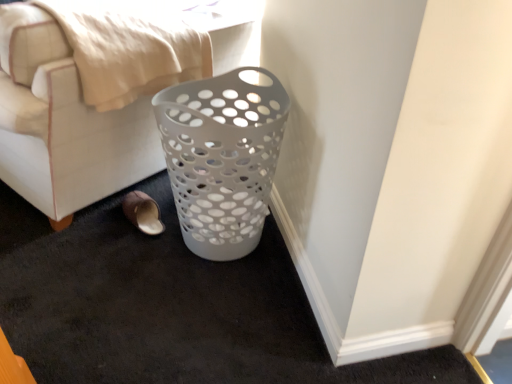
This screenshot has height=384, width=512. In order to click on brown suede slipper at lower left in this screenshot , I will do `click(143, 213)`.

Where is `white plastic laundry basket at lower center`? The height and width of the screenshot is (384, 512). white plastic laundry basket at lower center is located at coordinates (63, 123).

Locate an element on the screen. The width and height of the screenshot is (512, 384). white plastic basket at lower right is located at coordinates (222, 157).

Considering the points (148, 218) and (250, 231), which point is in front, point (148, 218) or point (250, 231)?

The point (250, 231) is closer to the camera.

Is brown suede slipper at lower left bigger than white plastic basket at lower right?

No, brown suede slipper at lower left is not bigger than white plastic basket at lower right.

Which object is thinner, brown suede slipper at lower left or white plastic basket at lower right?

brown suede slipper at lower left is thinner.

Considering the relative positions of brown suede slipper at lower left and white plastic basket at lower right in the image provided, is brown suede slipper at lower left to the left of white plastic basket at lower right from the viewer's perspective?

Yes.

Which point is more forward, [1,162] or [132,201]?

The point [1,162] is closer to the camera.

Can you tell me how much white plastic laundry basket at lower center and brown suede slipper at lower left differ in facing direction?

The angle between the facing direction of white plastic laundry basket at lower center and the facing direction of brown suede slipper at lower left is 21.6 degrees.

From the image's perspective, which one is positioned higher, white plastic laundry basket at lower center or brown suede slipper at lower left?

From the image's view, white plastic laundry basket at lower center is above.

Considering the positions of objects white plastic laundry basket at lower center and brown suede slipper at lower left in the image provided, who is more to the left, white plastic laundry basket at lower center or brown suede slipper at lower left?

white plastic laundry basket at lower center.

From the image's perspective, is white plastic basket at lower right located above brown suede slipper at lower left?

Yes, from the image's perspective, white plastic basket at lower right is over brown suede slipper at lower left.

Is white plastic basket at lower right not within brown suede slipper at lower left?

That's correct, white plastic basket at lower right is outside of brown suede slipper at lower left.

Identify the location of basket on the right of brown suede slipper at lower left. (222, 157).

Considering the sizes of white plastic basket at lower right and brown suede slipper at lower left in the image, is white plastic basket at lower right bigger or smaller than brown suede slipper at lower left?

In the image, white plastic basket at lower right appears to be larger than brown suede slipper at lower left.

How many degrees apart are the facing directions of brown suede slipper at lower left and white plastic laundry basket at lower center?

21.6 degrees separate the facing orientations of brown suede slipper at lower left and white plastic laundry basket at lower center.

Is point (136, 220) in front of point (9, 114)?

That is False.

Choose the correct answer: Is brown suede slipper at lower left inside white plastic laundry basket at lower center or outside it?

brown suede slipper at lower left lies within the bounds of white plastic laundry basket at lower center.

Is white plastic laundry basket at lower center to the right of white plastic basket at lower right from the viewer's perspective?

No, white plastic laundry basket at lower center is not to the right of white plastic basket at lower right.

Where is `furniture above the white plastic basket at lower right (from the image's perspective)`? furniture above the white plastic basket at lower right (from the image's perspective) is located at coordinates (63, 123).

Consider the image. In the image, is white plastic laundry basket at lower center positioned in front of or behind white plastic basket at lower right?

white plastic laundry basket at lower center is in front of white plastic basket at lower right.

From a real-world perspective, which object rests below the other?

From a 3D spatial view, white plastic basket at lower right is below.

In the scene shown: From a real-world perspective, relative to white plastic laundry basket at lower center, is white plastic basket at lower right vertically above or below?

In terms of real-world spatial position, white plastic basket at lower right is below white plastic laundry basket at lower center.

At what (x,y) coordinates should I click in order to perform the action: click on basket lying behind the white plastic laundry basket at lower center. Please return your answer as a coordinate pair (x, y). Image resolution: width=512 pixels, height=384 pixels. Looking at the image, I should click on (222, 157).

Considering the positions of objects white plastic basket at lower right and white plastic laundry basket at lower center in the image provided, who is in front, white plastic basket at lower right or white plastic laundry basket at lower center?

Positioned in front is white plastic laundry basket at lower center.

Identify the location of basket that appears on the right of brown suede slipper at lower left. This screenshot has height=384, width=512. (222, 157).

I want to click on footwear that appears below the white plastic laundry basket at lower center (from the image's perspective), so click(x=143, y=213).

From the picture: Which object lies nearer to the anchor point brown suede slipper at lower left, white plastic basket at lower right or white plastic laundry basket at lower center?

white plastic laundry basket at lower center is positioned closer to the anchor brown suede slipper at lower left.

Estimate the real-world distances between objects in this image. Which object is further from white plastic laundry basket at lower center, brown suede slipper at lower left or white plastic basket at lower right?

Among the two, white plastic basket at lower right is located further to white plastic laundry basket at lower center.

From the image, which object appears to be farther from white plastic basket at lower right, brown suede slipper at lower left or white plastic laundry basket at lower center?

Based on the image, brown suede slipper at lower left appears to be further to white plastic basket at lower right.

Looking at the image, which one is located closer to white plastic laundry basket at lower center, white plastic basket at lower right or brown suede slipper at lower left?

The object closer to white plastic laundry basket at lower center is brown suede slipper at lower left.

Looking at the image, which one is located closer to brown suede slipper at lower left, white plastic laundry basket at lower center or white plastic basket at lower right?

Based on the image, white plastic laundry basket at lower center appears to be nearer to brown suede slipper at lower left.

When comparing their distances from white plastic basket at lower right, does white plastic laundry basket at lower center or brown suede slipper at lower left seem closer?

white plastic laundry basket at lower center is positioned closer to the anchor white plastic basket at lower right.

Locate an element on the screen. This screenshot has width=512, height=384. basket located between white plastic laundry basket at lower center and brown suede slipper at lower left in the depth direction is located at coordinates click(x=222, y=157).